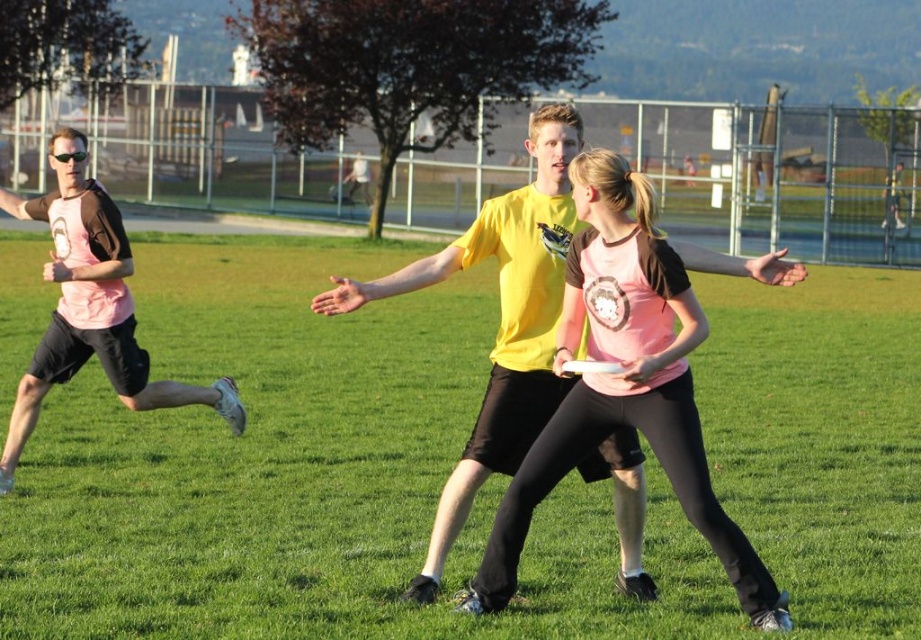
Measure the distance between green grass at center and pink matte t-shirt at left.

green grass at center and pink matte t-shirt at left are 26.68 feet apart.

Is point (344, 353) closer to viewer compared to point (16, 449)?

No.

At what (x,y) coordinates should I click in order to perform the action: click on green grass at center. Please return your answer as a coordinate pair (x, y). Looking at the image, I should click on (309, 474).

Is green grass at center positioned before pink matte jersey at center?

No, green grass at center is behind pink matte jersey at center.

Is green grass at center to the right of pink matte jersey at center from the viewer's perspective?

No, green grass at center is not to the right of pink matte jersey at center.

Where is `green grass at center`? Image resolution: width=921 pixels, height=640 pixels. green grass at center is located at coordinates (309, 474).

Who is shorter, pink matte jersey at center or pink matte t-shirt at left?

Standing shorter between the two is pink matte t-shirt at left.

Does pink matte jersey at center appear on the right side of pink matte t-shirt at left?

Yes, pink matte jersey at center is to the right of pink matte t-shirt at left.

Is point (653, 419) less distant than point (118, 300)?

Yes, it is.

Locate an element on the screen. This screenshot has height=640, width=921. pink matte jersey at center is located at coordinates (624, 385).